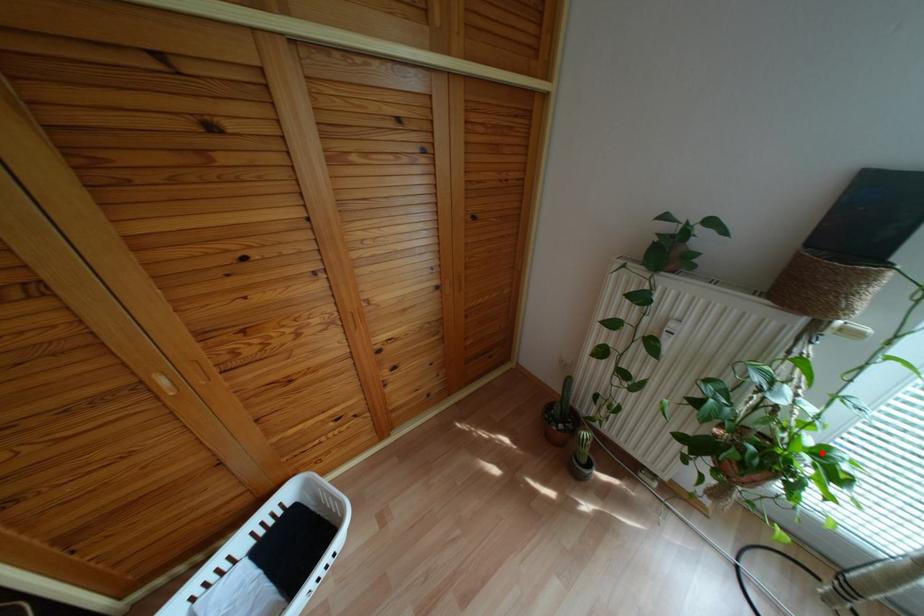
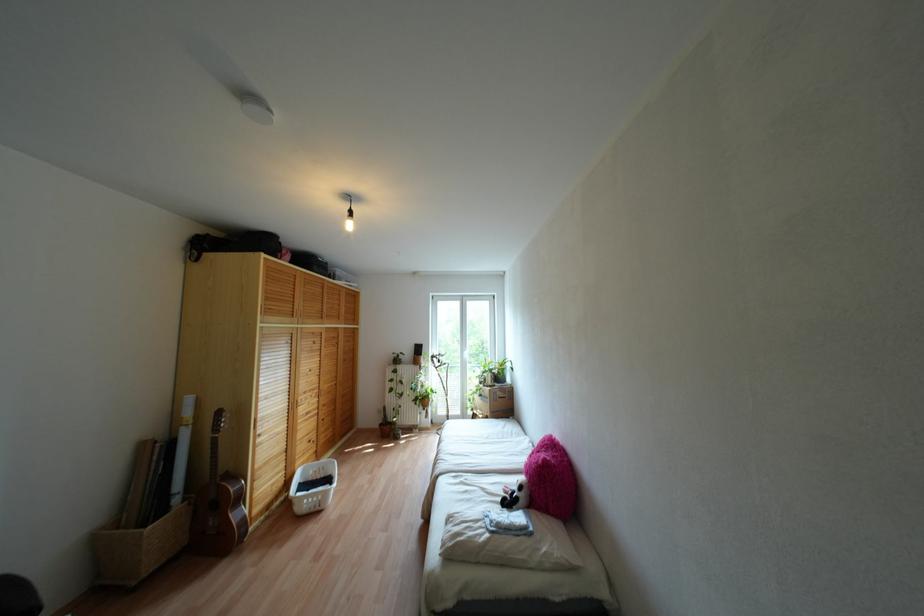
Question: I am providing you with two images of the same scene from different viewpoints. A red point is shown in image1. For the corresponding object point in image2, is it positioned nearer or farther from the camera?

Choices:
 (A) Nearer
 (B) Farther

Answer: (B)